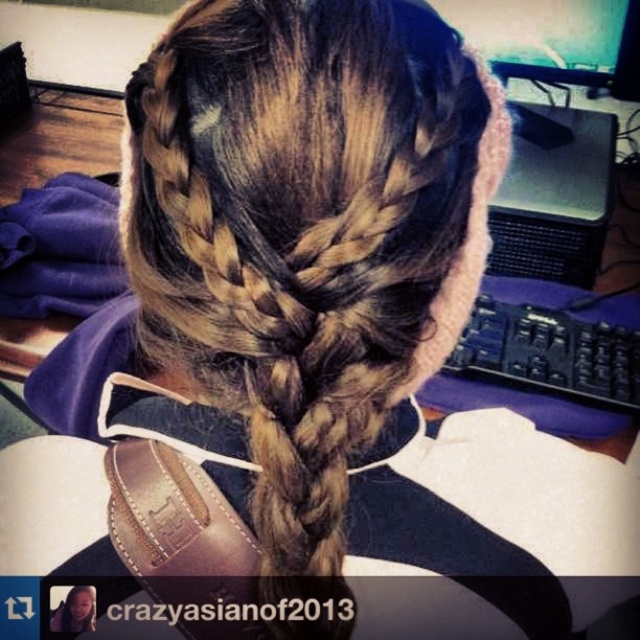
You are setting up a home office and need to place the black plastic computer at right and the matte plastic monitor at upper center on your desk. Based on their positions in the image, which object should you place higher on the desk?

The matte plastic monitor at upper center should be placed higher on the desk since it is positioned above the black plastic computer at right in the image.

You are looking at the two points on the image. Which point is nearer to you, point (x=561, y=176) or point (x=573, y=84)?

Point (x=561, y=176) is closer to the viewer than point (x=573, y=84).